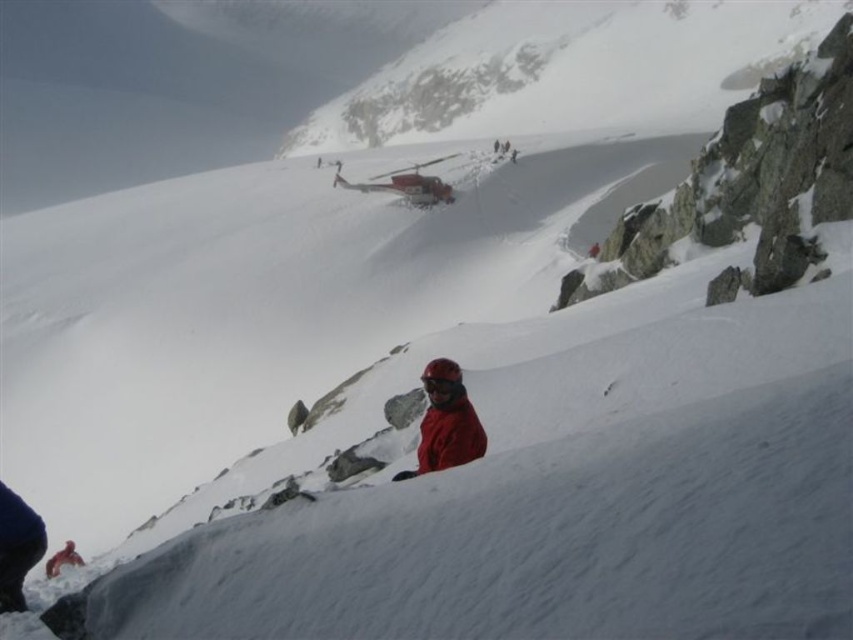
Question: Can you confirm if matte red jacket at center is positioned to the right of red matte jacket at lower center?

Choices:
 (A) yes
 (B) no

Answer: (A)

Question: Which of the following is the closest to the observer?

Choices:
 (A) matte red jacket at center
 (B) red matte jacket at lower center

Answer: (A)

Question: Can you confirm if matte red jacket at center is smaller than red matte jacket at lower center?

Choices:
 (A) no
 (B) yes

Answer: (B)

Question: Does matte red jacket at center appear on the left side of red matte jacket at lower center?

Choices:
 (A) yes
 (B) no

Answer: (B)